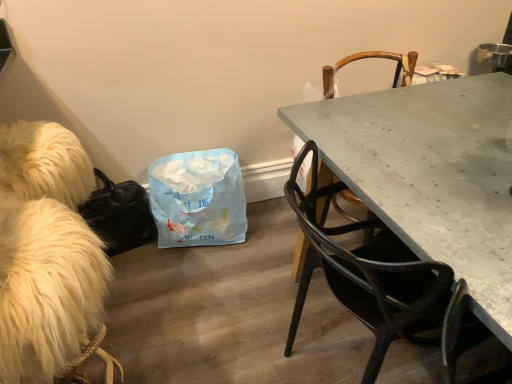
Question: From the image's perspective, is metallic gray chair at right, which appears as the 1th chair when viewed from the back, positioned above or below matte black chair at right, which is counted as the 2th chair, starting from the back?

Choices:
 (A) below
 (B) above

Answer: (B)

Question: Is point (399, 66) closer or farther from the camera than point (377, 286)?

Choices:
 (A) closer
 (B) farther

Answer: (B)

Question: Which is farther from the light blue paper bag at center?

Choices:
 (A) matte black chair at right, the 1th chair viewed from the front
 (B) metallic gray chair at right, which appears as the 1th chair when viewed from the back
 (C) white fluffy dog at left

Answer: (A)

Question: Based on their relative distances, which object is nearer to the white fluffy dog at left?

Choices:
 (A) matte black chair at right, the 1th chair viewed from the front
 (B) metallic gray chair at right, which appears as the 1th chair when viewed from the back
 (C) light blue paper bag at center

Answer: (C)